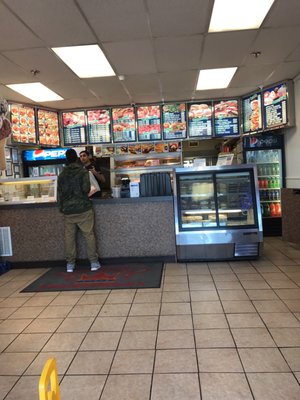
Locate an element on the screen. This screenshot has width=300, height=400. mat is located at coordinates (129, 278).